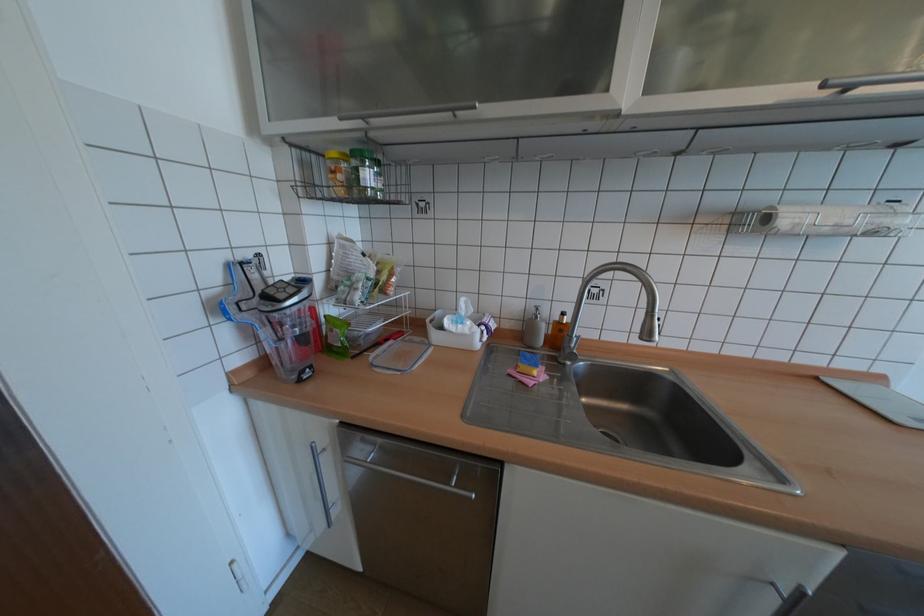
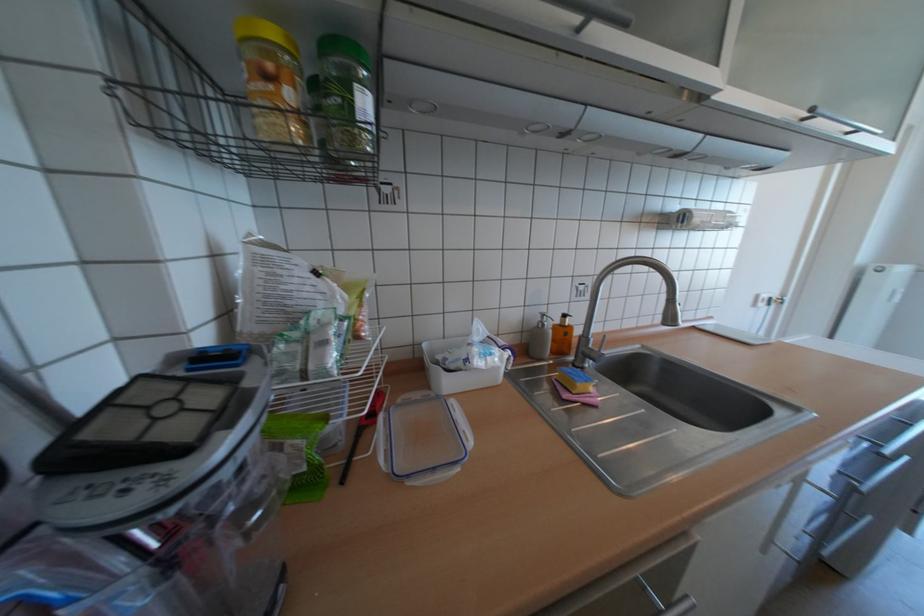
Question: The images are taken continuously from a first-person perspective. In which direction is your viewpoint rotating?

Choices:
 (A) Left
 (B) Right
 (C) Up
 (D) Down

Answer: (B)